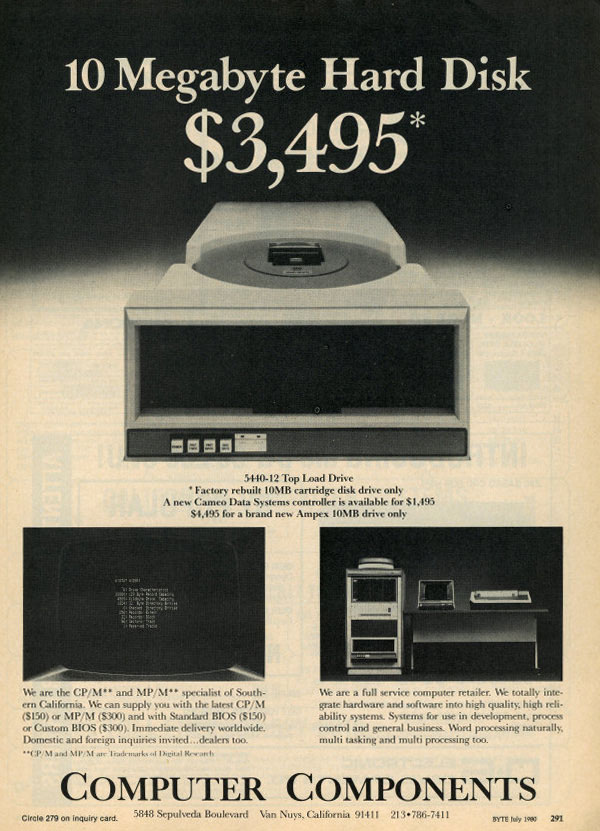
Identify the location of desk. (469, 618).